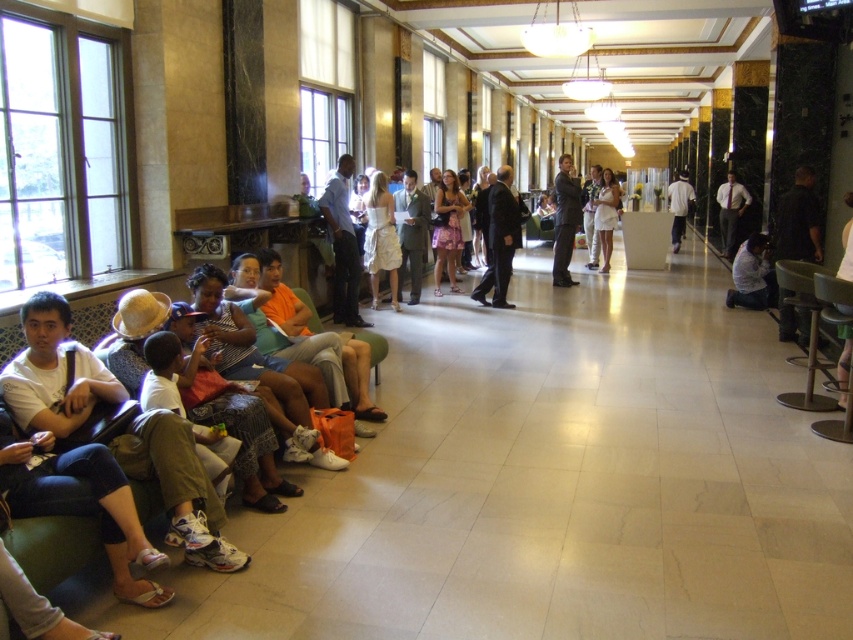
Which is above, dark gray suit at center or white shirt and dark pants at center-right?

white shirt and dark pants at center-right is higher up.

Is point (566, 282) less distant than point (722, 209)?

Yes, it is in front of point (722, 209).

You are a GUI agent. You are given a task and a screenshot of the screen. Output one action in this format:
    pyautogui.click(x=<x>, y=<y>)
    Task: Click on the dark gray suit at center
    
    Given the screenshot: What is the action you would take?
    pyautogui.click(x=564, y=220)

Which of these two, dark gray suit at center or white matte shirt at center, stands taller?

Standing taller between the two is white matte shirt at center.

Can you confirm if dark gray suit at center is positioned below white matte shirt at center?

Correct, dark gray suit at center is located below white matte shirt at center.

Is point (566, 192) positioned after point (691, 202)?

No, (566, 192) is closer to viewer.

This screenshot has height=640, width=853. In order to click on dark gray suit at center in this screenshot , I will do `click(564, 220)`.

How far apart are white shirt at center and white shirt and dark pants at center-right?

The distance of white shirt at center from white shirt and dark pants at center-right is 14.57 feet.

This screenshot has width=853, height=640. Describe the element at coordinates (752, 275) in the screenshot. I see `white shirt at center` at that location.

Find the location of a particular element. This screenshot has height=640, width=853. white shirt at center is located at coordinates (752, 275).